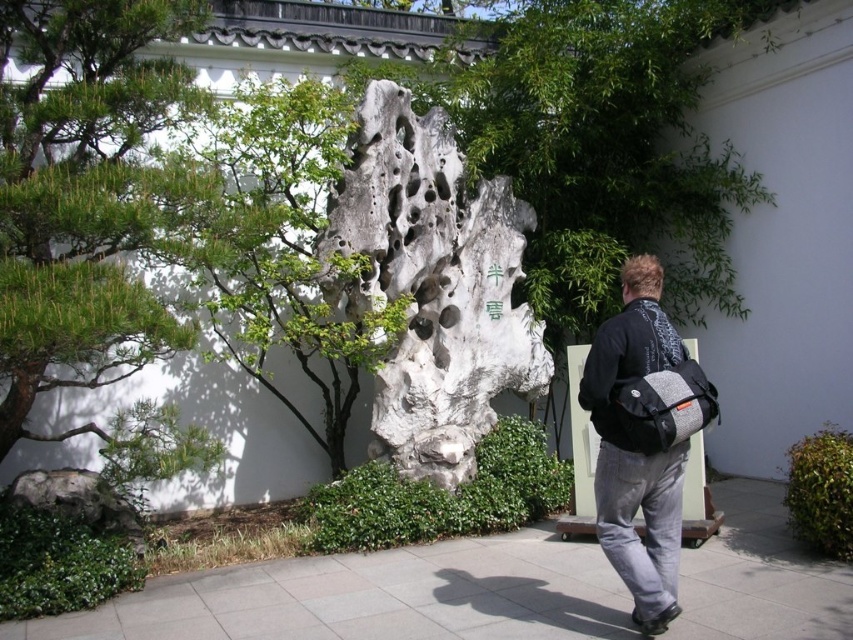
You are standing in the traditional East Asian garden and want to place a decorative lantern exactly at the center of the white porous rock at center. According to the garden layout, can you confirm if the coordinates provided for the rock allow precise placement?

The white porous rock at center is located at point (599, 147), so placing the decorative lantern exactly at these coordinates would position it precisely at the center of the rock.

You are standing in the garden and want to take a photo of the white porous rock at center. Based on its position, where should you aim your camera to capture it in the frame?

The white porous rock at center is located at the 2D coordinates point (599, 147), so aim your camera towards that position to capture it in the frame.